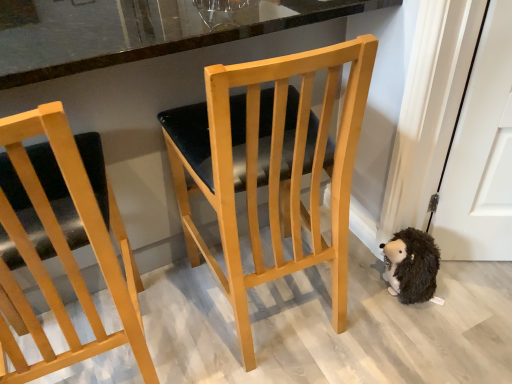
Question: From the image's perspective, is light wood chair at left, which appears as the first chair when viewed from the left, positioned above or below light wood chair at center, acting as the first chair starting from the right?

Choices:
 (A) below
 (B) above

Answer: (A)

Question: Do you think light wood chair at left, which appears as the first chair when viewed from the left, is within light wood chair at center, arranged as the 2th chair when viewed from the left, or outside of it?

Choices:
 (A) outside
 (B) inside

Answer: (A)

Question: Which of these objects is positioned closest to the light wood chair at center, arranged as the 2th chair when viewed from the left?

Choices:
 (A) light wood chair at left, placed as the second chair when sorted from right to left
 (B) black fuzzy stuffed animal at lower right

Answer: (A)

Question: Based on their relative distances, which object is farther from the light wood chair at left, placed as the second chair when sorted from right to left?

Choices:
 (A) light wood chair at center, arranged as the 2th chair when viewed from the left
 (B) black fuzzy stuffed animal at lower right

Answer: (B)